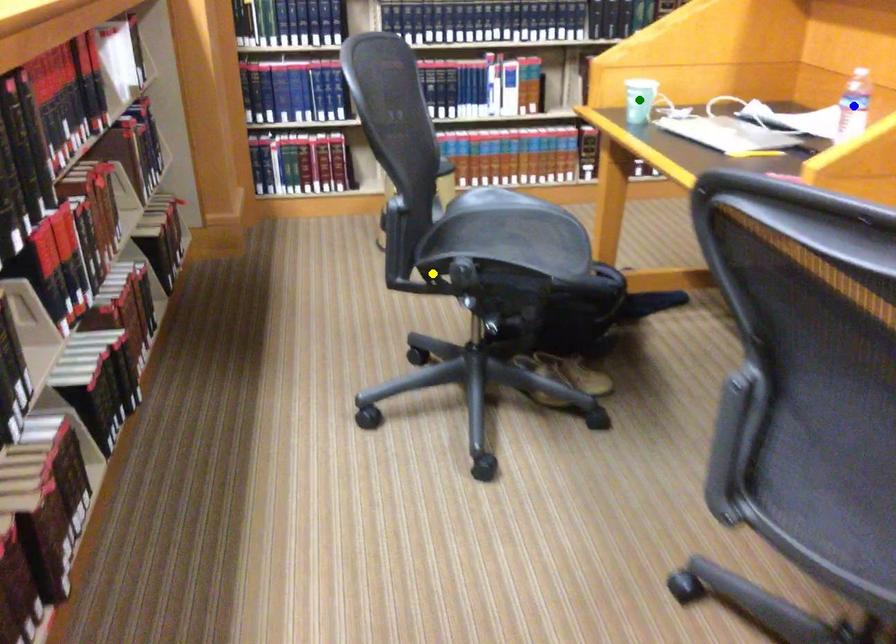
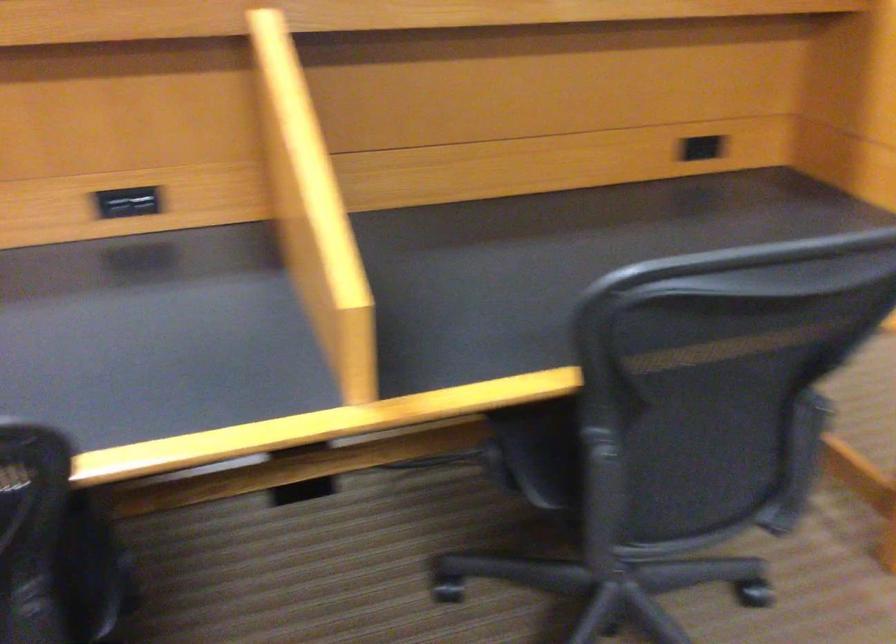
I am providing you with two images of the same scene from different viewpoints. Three points are marked in image1. Which point corresponds to a part or object that is occluded in image2?In image1, three points are marked. Which of them correspond to a part or object that is occluded in image2?Among the three points shown in image1, which one corresponds to a part or object that is no longer visible due to occlusion in image2?

Invisible in image2: green point, yellow point, blue point.